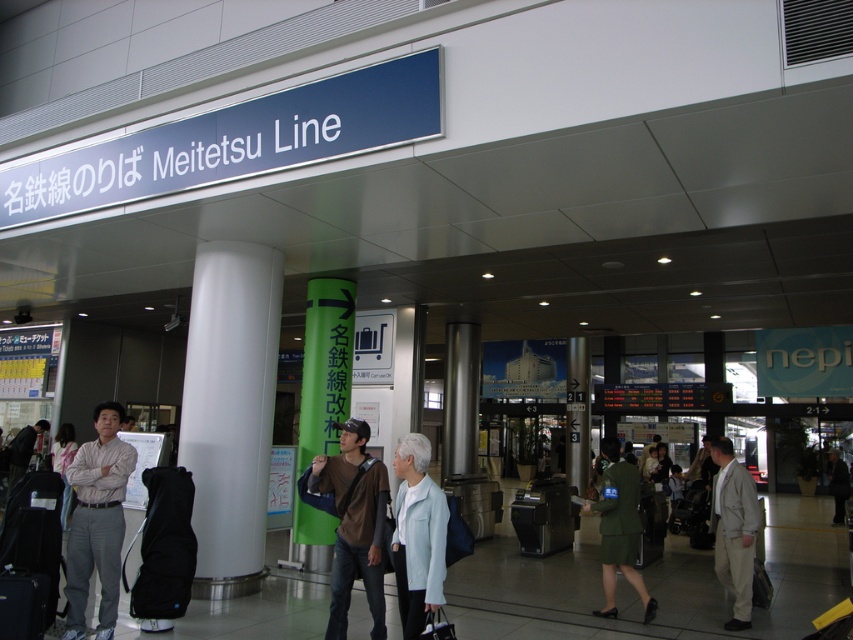
Is green matte signpost at center to the right of black fabric suitcase at lower left from the viewer's perspective?

Yes, green matte signpost at center is to the right of black fabric suitcase at lower left.

Is green matte signpost at center further to camera compared to black fabric suitcase at lower left?

Yes, it is behind black fabric suitcase at lower left.

Is point (343, 358) positioned before point (45, 481)?

No, (343, 358) is behind (45, 481).

What are the coordinates of `green matte signpost at center` in the screenshot? It's located at (325, 365).

Can you confirm if light blue fabric jacket at lower center is bigger than dark brown leather jacket at left?

No, light blue fabric jacket at lower center is not bigger than dark brown leather jacket at left.

Can you confirm if light blue fabric jacket at lower center is taller than dark brown leather jacket at left?

Yes.

Where is `light blue fabric jacket at lower center`? light blue fabric jacket at lower center is located at coordinates (416, 536).

Find the location of a particular element. The image size is (853, 640). light blue fabric jacket at lower center is located at coordinates (416, 536).

Can you confirm if white glossy pillar at center is thinner than green matte pillar at center?

Incorrect, white glossy pillar at center's width is not less than green matte pillar at center's.

Does white glossy pillar at center lie behind green matte pillar at center?

That is False.

Does point (216, 534) lie behind point (578, 397)?

That is False.

Find the location of a particular element. white glossy pillar at center is located at coordinates (230, 410).